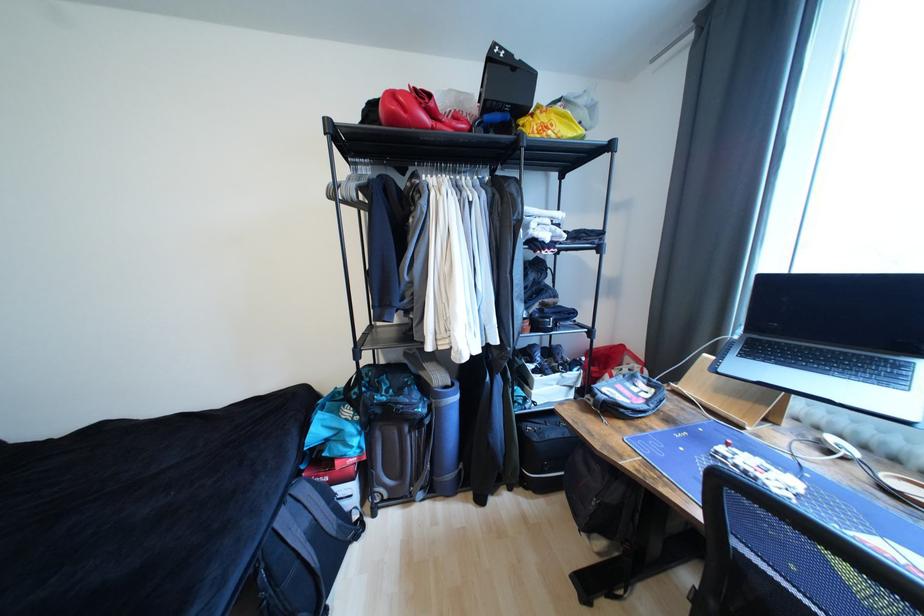
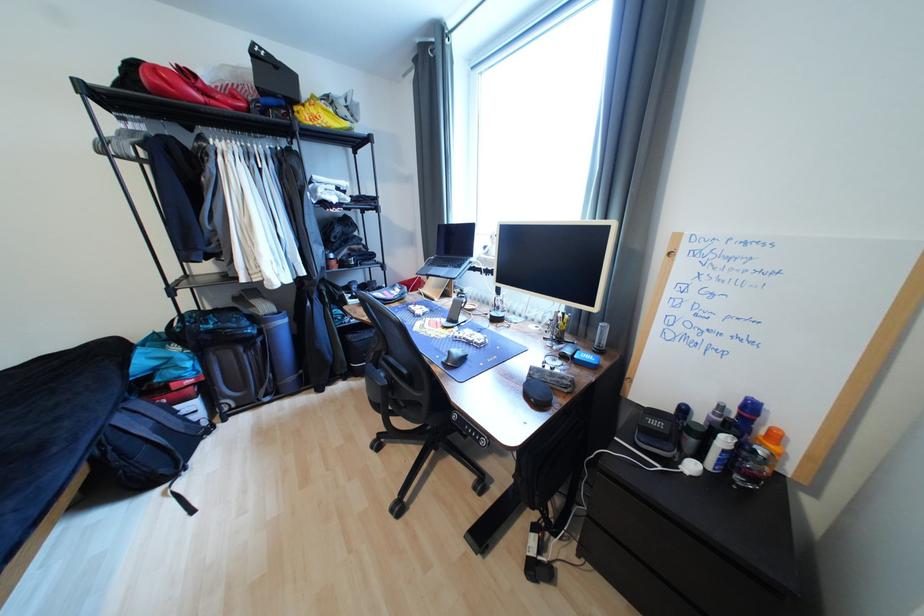
In a continuous first-person perspective shot, in which direction is the camera moving?

The movement direction of the cameraman is right, backward.